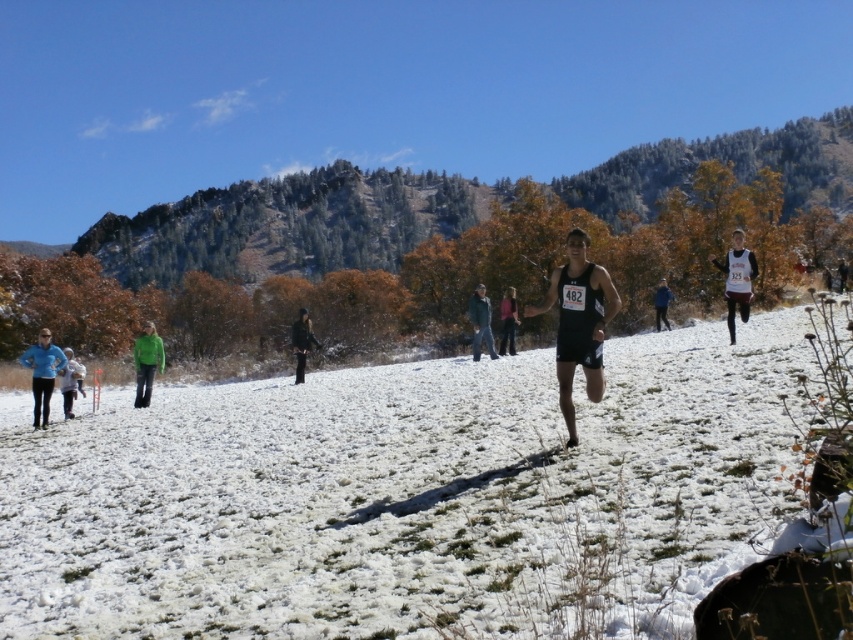
Question: Estimate the real-world distances between objects in this image. Which object is farther from the dark brown leather jacket at center?

Choices:
 (A) white fluffy snow at center
 (B) green fabric pants at lower left

Answer: (A)

Question: Which object appears closest to the camera in this image?

Choices:
 (A) green wool jacket at center
 (B) light blue fabric jacket at lower left
 (C) matte black tank top at center
 (D) dark blue running suit at center

Answer: (B)

Question: Which of these objects is positioned farthest from the white fluffy snow at center?

Choices:
 (A) dark brown leather jacket at center
 (B) matte black tank top at center
 (C) light blue fabric jacket at lower left

Answer: (B)

Question: Is white matte running suit at upper right positioned in front of green fabric pants at lower left?

Choices:
 (A) no
 (B) yes

Answer: (B)

Question: Can you confirm if blue fleece jacket at lower left is positioned to the right of dark blue running suit at center?

Choices:
 (A) no
 (B) yes

Answer: (A)

Question: Does white matte running suit at upper right have a smaller size compared to matte black tank top at center?

Choices:
 (A) yes
 (B) no

Answer: (B)